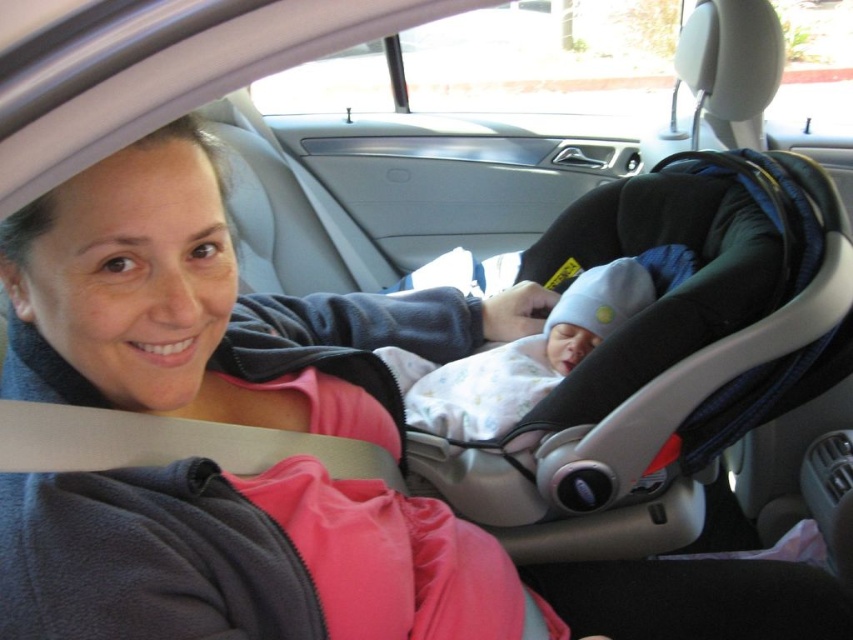
You are a passenger in the car and want to reach for an object located at point (793, 312) and another object at point (622, 323). Which point is closer to your hand if you are sitting in the front passenger seat?

Point (793, 312) is closer to the camera than point (622, 323), so the object at point (793, 312) is closer to your hand.

From the picture: You are a safety inspector checking the car seat installation. According to the manufacturer guidelines, the distance between the baby and the car seat should be less than 2 inches to ensure proper harness fit. Is the current distance between the black textured car seat at center and the white soft fabric baby at center within the recommended safety range?

The distance between the black textured car seat at center and the white soft fabric baby at center is 4.03 inches, which exceeds the recommended 2 inches. This means the harness may not be properly fitted, posing a safety risk. Adjust the car seat or baby position to reduce the distance.